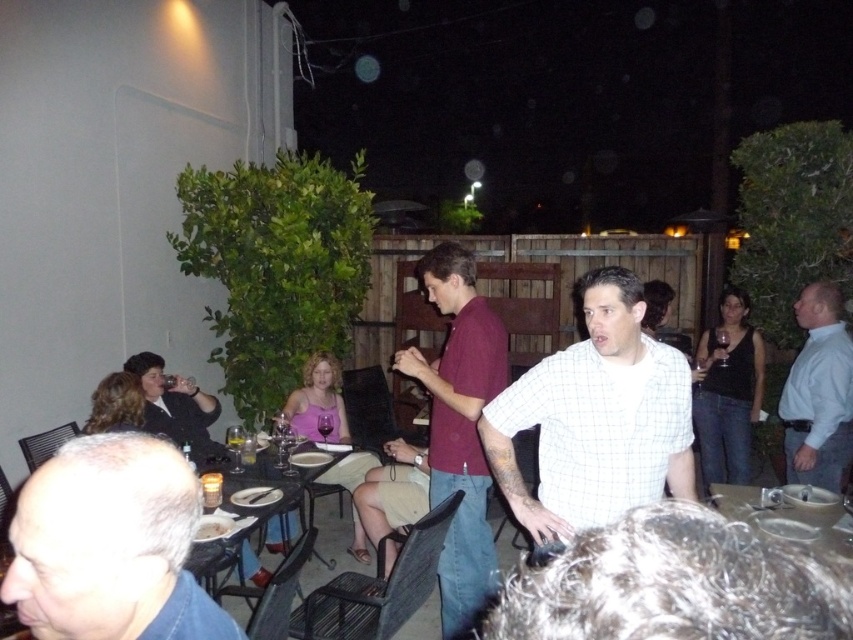
You are at the point labeled point (193, 564) and want to walk to the exit located at point (788, 397). Is there a clear path between these two points without needing to go around any obstacles?

Point (788, 397) is behind point (193, 564), so there might be obstacles between them. You might need to go around.

You are a waiter at the restaurant and need to serve two guests. One has gray hair at lower left and the other is seated at the metallic silver table at center. Which guest requires a smaller portion of food based on their physical size?

The gray hair at lower left has a lesser width compared to the metallic silver table at center, so the guest with gray hair at lower left requires a smaller portion of food based on their physical size.